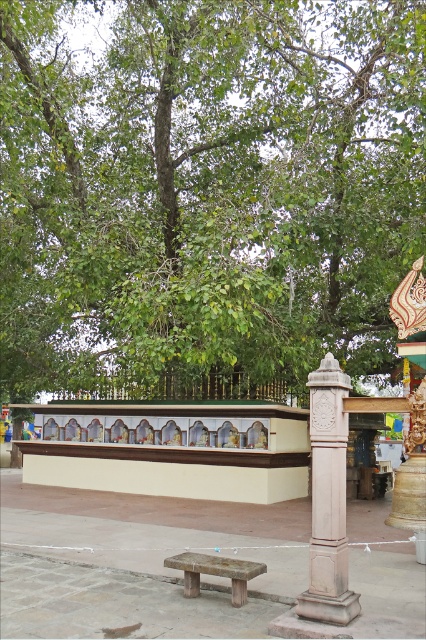
Question: Which of the following is the farthest from the observer?

Choices:
 (A) wooden bench at center
 (B) green leafy tree at upper center
 (C) white stone column at right

Answer: (B)

Question: Which point appears closest to the camera in this image?

Choices:
 (A) (109, 333)
 (B) (190, 596)
 (C) (325, 456)

Answer: (C)

Question: Estimate the real-world distances between objects in this image. Which object is closer to the white stone column at right?

Choices:
 (A) green leafy tree at upper center
 (B) wooden bench at center

Answer: (B)

Question: Does white stone column at right come in front of wooden bench at center?

Choices:
 (A) yes
 (B) no

Answer: (A)

Question: Does green leafy tree at upper center have a smaller size compared to wooden bench at center?

Choices:
 (A) no
 (B) yes

Answer: (A)

Question: Can you confirm if green leafy tree at upper center is positioned to the left of white stone column at right?

Choices:
 (A) no
 (B) yes

Answer: (B)